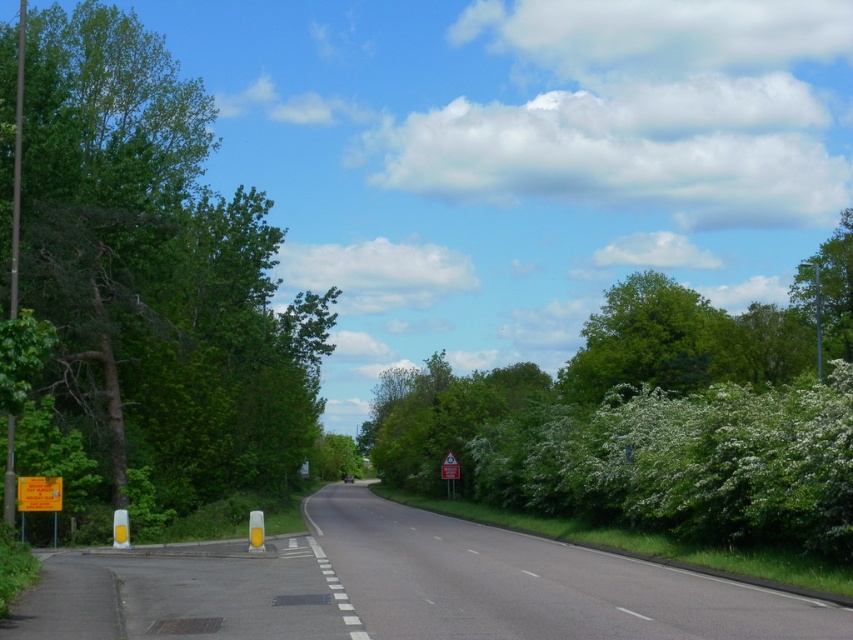
You are a pedestrian standing on the rural road and want to reach the metallic reflective triangular sign at center. Which direction should you walk to avoid the green leafy tree at left?

To reach the metallic reflective triangular sign at center while avoiding the green leafy tree at left, you should walk to the right side of the road since the tree is located to the left of the sign.

You are a pedestrian standing at the center of the road. You want to walk to the green leafy tree at left. Which direction should you turn to reach it?

The green leafy tree at left is located at the left side of the road, so you should turn left to reach it.